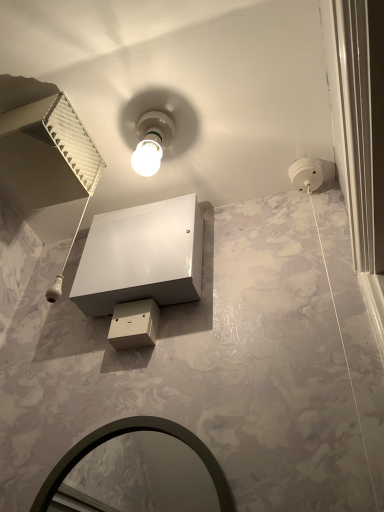
Describe the element at coordinates (141, 257) in the screenshot. I see `white glossy vanity at center` at that location.

Where is `white glossy bulb at upper center`? The width and height of the screenshot is (384, 512). white glossy bulb at upper center is located at coordinates (152, 141).

Based on the photo, is matte black mirror at lower center next to white glossy bulb at upper center and touching it?

No, matte black mirror at lower center is not beside white glossy bulb at upper center.

Which is nearer, (199,460) or (142,144)?

The point (142,144) is more forward.

Considering the sizes of matte black mirror at lower center and white glossy bulb at upper center in the image, is matte black mirror at lower center bigger or smaller than white glossy bulb at upper center?

matte black mirror at lower center is bigger than white glossy bulb at upper center.

Identify the location of light fixture above the matte black mirror at lower center (from the image's perspective). (152, 141).

Could you tell me if white glossy bulb at upper center is facing white glossy vanity at center?

No, white glossy bulb at upper center is not oriented towards white glossy vanity at center.

Is point (157, 144) closer or farther from the camera than point (124, 298)?

Point (157, 144) is positioned farther from the camera compared to point (124, 298).

From the image's perspective, between white glossy bulb at upper center and white glossy vanity at center, who is located below?

white glossy vanity at center is shown below in the image.

The width and height of the screenshot is (384, 512). What are the coordinates of `mirror in front of the white glossy bulb at upper center` in the screenshot? It's located at (137, 472).

How many degrees apart are the facing directions of white glossy bulb at upper center and matte black mirror at lower center?

There is a 0.0453-degree angle between the facing directions of white glossy bulb at upper center and matte black mirror at lower center.

Are white glossy bulb at upper center and matte black mirror at lower center far apart?

white glossy bulb at upper center is near matte black mirror at lower center, not far away.

Who is bigger, white glossy bulb at upper center or matte black mirror at lower center?

→ matte black mirror at lower center.

From the image's perspective, between white glossy vanity at center and white glossy bulb at upper center, which one is located above?

From the image's view, white glossy bulb at upper center is above.

Is white glossy vanity at center at the right side of white glossy bulb at upper center?

No.

Is white glossy vanity at center positioned far away from white glossy bulb at upper center?

No, white glossy vanity at center is not far from white glossy bulb at upper center.

Is white glossy vanity at center facing towards white glossy bulb at upper center?

Yes, white glossy vanity at center is facing white glossy bulb at upper center.

Is white glossy vanity at center at the left side of matte black mirror at lower center?

Correct, you'll find white glossy vanity at center to the left of matte black mirror at lower center.

How different are the orientations of white glossy vanity at center and matte black mirror at lower center in degrees?

They differ by 0.993 degrees in their facing directions.

Can you confirm if white glossy vanity at center is thinner than matte black mirror at lower center?

Incorrect, the width of white glossy vanity at center is not less than that of matte black mirror at lower center.

Identify the location of mirror in front of the white glossy vanity at center. (137, 472).

Who is smaller, matte black mirror at lower center or white glossy vanity at center?

With smaller size is matte black mirror at lower center.

From the picture: Considering the sizes of objects matte black mirror at lower center and white glossy vanity at center in the image provided, who is wider, matte black mirror at lower center or white glossy vanity at center?

white glossy vanity at center.

From the image's perspective, is matte black mirror at lower center on white glossy vanity at center?

Actually, matte black mirror at lower center appears below white glossy vanity at center in the image.

There is a matte black mirror at lower center. Where is `light fixture above it (from a real-world perspective)`? The width and height of the screenshot is (384, 512). light fixture above it (from a real-world perspective) is located at coordinates (152, 141).

You are a GUI agent. You are given a task and a screenshot of the screen. Output one action in this format:
    pyautogui.click(x=<x>, y=<y>)
    Task: Click on the light fixture that is above the white glossy vanity at center (from the image's perspective)
    The image size is (384, 512).
    Given the screenshot: What is the action you would take?
    pyautogui.click(x=152, y=141)

Based on their spatial positions, is matte black mirror at lower center or white glossy bulb at upper center closer to white glossy vanity at center?

white glossy bulb at upper center lies closer to white glossy vanity at center than the other object.

Estimate the real-world distances between objects in this image. Which object is further from white glossy bulb at upper center, white glossy vanity at center or matte black mirror at lower center?

Based on the image, matte black mirror at lower center appears to be further to white glossy bulb at upper center.

Based on their spatial positions, is matte black mirror at lower center or white glossy vanity at center further from white glossy bulb at upper center?

matte black mirror at lower center.

From the image, which object appears to be farther from white glossy vanity at center, white glossy bulb at upper center or matte black mirror at lower center?

matte black mirror at lower center.

When comparing their distances from matte black mirror at lower center, does white glossy vanity at center or white glossy bulb at upper center seem closer?

white glossy vanity at center is positioned closer to the anchor matte black mirror at lower center.

Looking at the image, which one is located further to matte black mirror at lower center, white glossy bulb at upper center or white glossy vanity at center?

The object further to matte black mirror at lower center is white glossy bulb at upper center.

Find the location of a particular element. The width and height of the screenshot is (384, 512). vanity between white glossy bulb at upper center and matte black mirror at lower center from top to bottom is located at coordinates (141, 257).